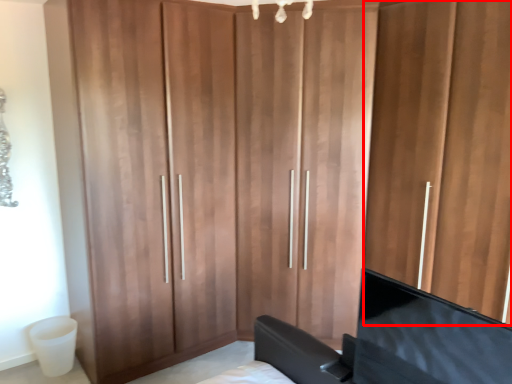
Question: From the image's perspective, considering the relative positions of door (annotated by the red box) and flat in the image provided, where is door (annotated by the red box) located with respect to the staircase?

Choices:
 (A) above
 (B) below

Answer: (A)